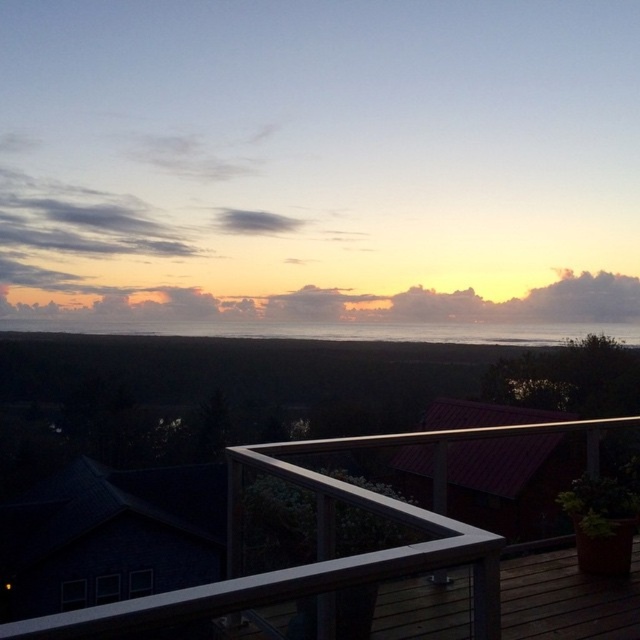
Question: Does white glass railing at upper center come behind silvery reflective water at center?

Choices:
 (A) yes
 (B) no

Answer: (B)

Question: Is white glass railing at upper center positioned before silvery reflective water at center?

Choices:
 (A) yes
 (B) no

Answer: (A)

Question: Which object is farther from the camera taking this photo?

Choices:
 (A) white glass railing at upper center
 (B) silvery reflective water at center

Answer: (B)

Question: Among these points, which one is nearest to the camera?

Choices:
 (A) (193, 332)
 (B) (369, 572)

Answer: (B)

Question: Can you confirm if white glass railing at upper center is thinner than silvery reflective water at center?

Choices:
 (A) no
 (B) yes

Answer: (B)